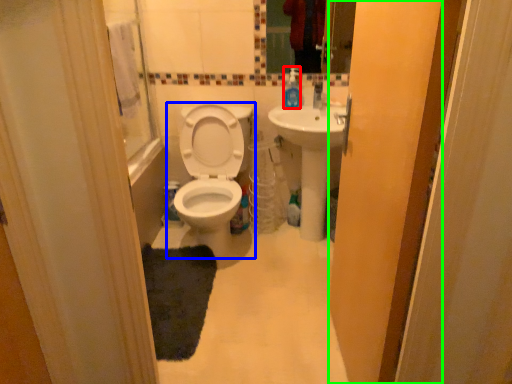
Question: Considering the real-world distances, which object is closest to soap dispenser (highlighted by a red box)? toilet (highlighted by a blue box) or screen door (highlighted by a green box).

Choices:
 (A) toilet
 (B) screen door

Answer: (A)